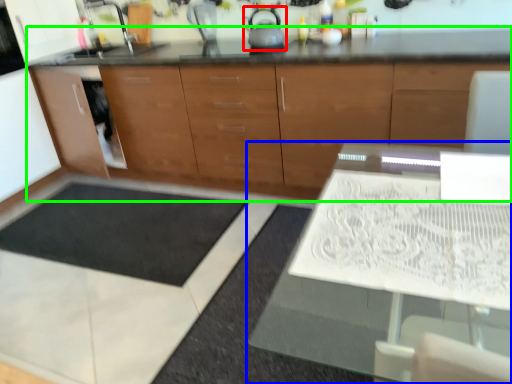
Question: Considering the real-world distances, which object is closest to tea pot (highlighted by a red box)? table (highlighted by a blue box) or cabinetry (highlighted by a green box).

Choices:
 (A) table
 (B) cabinetry

Answer: (B)